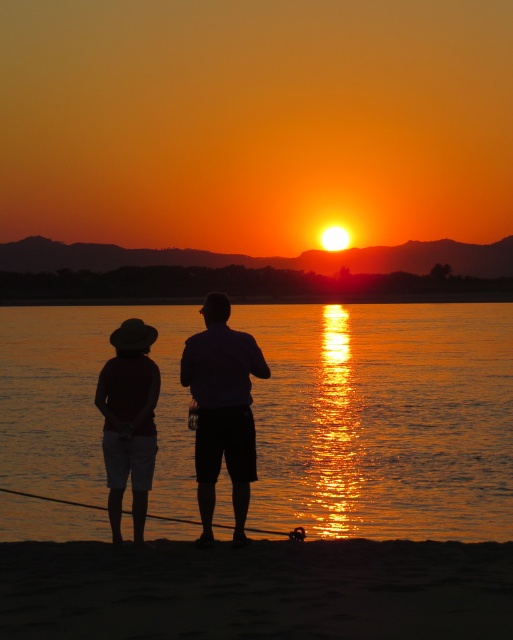
You are a photographer trying to capture the sunset. You notice the matte black hat at lower left and the metallic wire fishing pole at lower center in your frame. Which object is blocking the view of the other?

The matte black hat at lower left is positioned over the metallic wire fishing pole at lower center, so it is blocking the view of the metallic wire fishing pole at lower center.